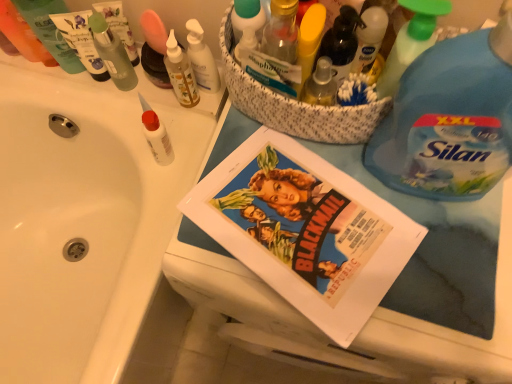
You are a GUI agent. You are given a task and a screenshot of the screen. Output one action in this format:
    pyautogui.click(x=<x>, y=<y>)
    Task: Click on the empty space that is ontop of matte paper comic book at center
    The image size is (512, 384).
    Given the screenshot: What is the action you would take?
    pyautogui.click(x=282, y=212)